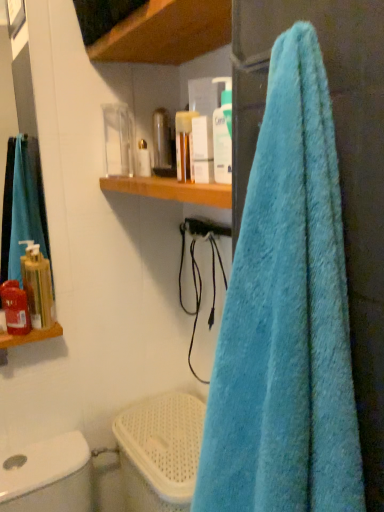
Question: From a real-world perspective, relative to wooden shelf at upper center, is matte red soap dispenser at left, the 4th toiletry from the right, vertically above or below?

Choices:
 (A) above
 (B) below

Answer: (B)

Question: Considering the positions of matte red soap dispenser at left, the 4th toiletry from the right, and wooden shelf at upper center in the image, is matte red soap dispenser at left, the 4th toiletry from the right, bigger or smaller than wooden shelf at upper center?

Choices:
 (A) big
 (B) small

Answer: (B)

Question: Which is nearer to the matte white container at upper center, placed as the second toiletry when sorted from right to left?

Choices:
 (A) gold metallic soap dispenser at left, which is the 2th toiletry from left to right
 (B) blue fluffy towel at right
 (C) wooden shelf at upper center
 (D) translucent plastic bottle at upper center, which ranks as the fourth toiletry in left-to-right order
 (E) white plastic toilet bowl at lower left

Answer: (C)

Question: Which is farther from the white plastic toilet bowl at lower left?

Choices:
 (A) gold metallic soap dispenser at left, which is the 2th toiletry from left to right
 (B) translucent plastic bottle at upper center, which ranks as the 2th toiletry in top-to-bottom order
 (C) matte white container at upper center, placed as the second toiletry when sorted from right to left
 (D) wooden shelf at upper center
 (E) matte red soap dispenser at left, which is the 2th toiletry from front to back

Answer: (D)